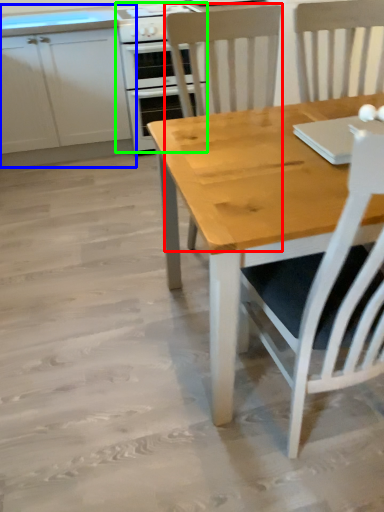
Question: Which is nearer to the chair (highlighted by a red box)? cabinetry (highlighted by a blue box) or kitchen appliance (highlighted by a green box).

Choices:
 (A) cabinetry
 (B) kitchen appliance

Answer: (B)